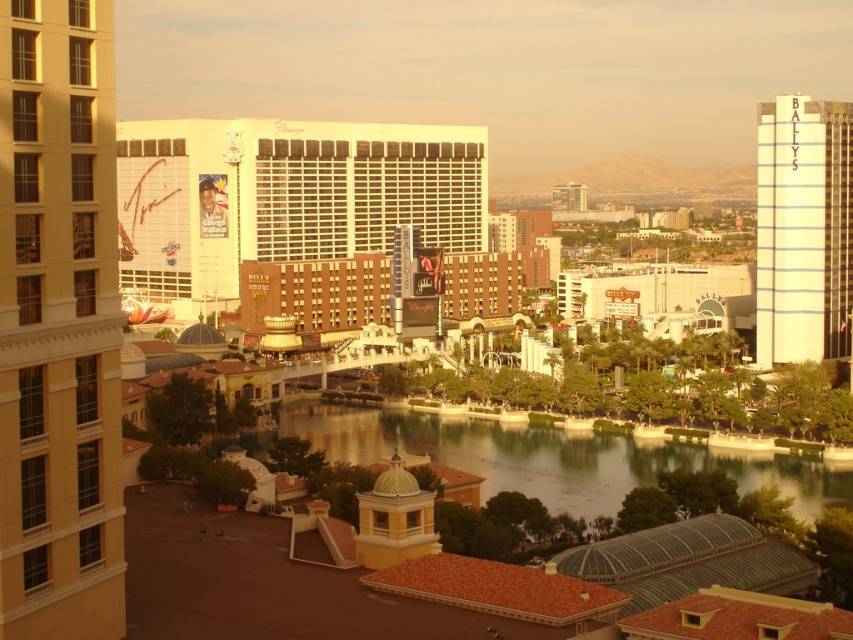
Based on the photo, who is higher up, greenish water at center or brown brick hotel at center?

brown brick hotel at center is higher up.

Who is positioned more to the left, greenish water at center or brown brick hotel at center?

Positioned to the left is brown brick hotel at center.

This screenshot has height=640, width=853. Identify the location of greenish water at center. coord(556,456).

Is white glossy hotel at center below greenish water at center?

No, white glossy hotel at center is not below greenish water at center.

At what (x,y) coordinates should I click in order to perform the action: click on white glossy hotel at center. Please return your answer as a coordinate pair (x, y). Looking at the image, I should click on (283, 196).

Does white glossy hotel at center have a lesser height compared to matte glass building at center?

No, white glossy hotel at center is not shorter than matte glass building at center.

Looking at this image, is white glossy hotel at center to the right of matte glass building at center from the viewer's perspective?

In fact, white glossy hotel at center is to the left of matte glass building at center.

Is point (416, 124) farther from viewer compared to point (579, 198)?

That is False.

This screenshot has height=640, width=853. I want to click on white glossy hotel at center, so click(283, 196).